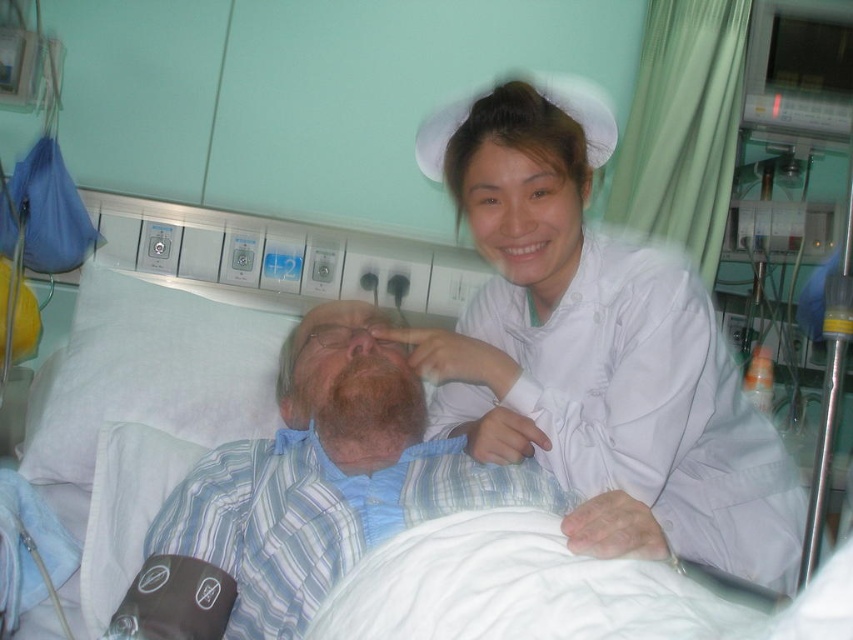
You are a nurse entering the hospital room and need to check the patient. Which object should you approach first, the white fabric hospital bed at center or the blue striped shirt at center?

You should approach the white fabric hospital bed at center first because it is positioned over the blue striped shirt at center, meaning the bed is closer to you.

You are a healthcare worker in the hospital room. You need to locate two points in the scene. The first point is at coordinate point (587, 365) and the second is at point (111, 396). Which point is closer to you?

Point (587, 365) is in front of point (111, 396), so the first point is closer to you.